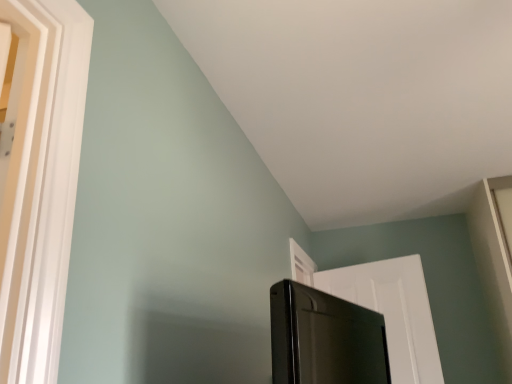
Describe the element at coordinates (394, 312) in the screenshot. I see `white matte door at upper right` at that location.

At what (x,y) coordinates should I click in order to perform the action: click on white matte door at upper right. Please return your answer as a coordinate pair (x, y). This screenshot has height=384, width=512. Looking at the image, I should click on (394, 312).

This screenshot has height=384, width=512. What do you see at coordinates (325, 338) in the screenshot?
I see `black glossy screen door at lower right` at bounding box center [325, 338].

The image size is (512, 384). Find the location of `black glossy screen door at lower right`. black glossy screen door at lower right is located at coordinates (325, 338).

At what (x,y) coordinates should I click in order to perform the action: click on white matte door at upper right. Please return your answer as a coordinate pair (x, y). This screenshot has width=512, height=384. Looking at the image, I should click on (394, 312).

Which is more to the left, white matte door at upper right or black glossy screen door at lower right?

black glossy screen door at lower right.

Considering the positions of objects white matte door at upper right and black glossy screen door at lower right in the image provided, who is in front, white matte door at upper right or black glossy screen door at lower right?

black glossy screen door at lower right is more forward.

Which is further, (382, 277) or (341, 321)?

The point (382, 277) is farther.

From the image's perspective, who appears lower, white matte door at upper right or black glossy screen door at lower right?

white matte door at upper right.

From a real-world perspective, who is located lower, white matte door at upper right or black glossy screen door at lower right?

In real-world perspective, black glossy screen door at lower right is lower.

Considering the sizes of objects white matte door at upper right and black glossy screen door at lower right in the image provided, who is thinner, white matte door at upper right or black glossy screen door at lower right?

Thinner between the two is white matte door at upper right.

Which of these two, white matte door at upper right or black glossy screen door at lower right, stands shorter?

black glossy screen door at lower right is shorter.

In terms of size, does white matte door at upper right appear bigger or smaller than black glossy screen door at lower right?

Clearly, white matte door at upper right is larger in size than black glossy screen door at lower right.

Can black glossy screen door at lower right be found inside white matte door at upper right?

No, black glossy screen door at lower right is located outside of white matte door at upper right.

Is white matte door at upper right not close to black glossy screen door at lower right?

Yes, white matte door at upper right is far from black glossy screen door at lower right.

Is white matte door at upper right looking in the opposite direction of black glossy screen door at lower right?

white matte door at upper right does not have its back to black glossy screen door at lower right.

I want to click on door located above the black glossy screen door at lower right (from a real-world perspective), so click(x=394, y=312).

Would you say black glossy screen door at lower right is to the left or to the right of white matte door at upper right in the picture?

From the image, it's evident that black glossy screen door at lower right is to the left of white matte door at upper right.

From the picture: Considering the positions of objects black glossy screen door at lower right and white matte door at upper right in the image provided, who is behind, black glossy screen door at lower right or white matte door at upper right?

white matte door at upper right is further from the camera.

Does point (300, 345) come closer to viewer compared to point (329, 282)?

Yes, point (300, 345) is in front of point (329, 282).

From the image's perspective, who appears lower, black glossy screen door at lower right or white matte door at upper right?

white matte door at upper right.

From a real-world perspective, is black glossy screen door at lower right above or below white matte door at upper right?

black glossy screen door at lower right is below white matte door at upper right.

Which object is wider, black glossy screen door at lower right or white matte door at upper right?

With larger width is black glossy screen door at lower right.

Considering the sizes of objects black glossy screen door at lower right and white matte door at upper right in the image provided, who is shorter, black glossy screen door at lower right or white matte door at upper right?

black glossy screen door at lower right is shorter.

Between black glossy screen door at lower right and white matte door at upper right, which one has smaller size?

black glossy screen door at lower right is smaller.

Is black glossy screen door at lower right inside or outside of white matte door at upper right?

black glossy screen door at lower right is not enclosed by white matte door at upper right.

Is black glossy screen door at lower right not near white matte door at upper right?

Yes.

Is black glossy screen door at lower right aimed at white matte door at upper right?

No, black glossy screen door at lower right is not facing towards white matte door at upper right.

Identify the location of screen door located in front of the white matte door at upper right. (325, 338).

This screenshot has height=384, width=512. In the image, there is a white matte door at upper right. Identify the location of screen door below it (from a real-world perspective). (325, 338).

Find the location of a particular element. Image resolution: width=512 pixels, height=384 pixels. door behind the black glossy screen door at lower right is located at coordinates (394, 312).